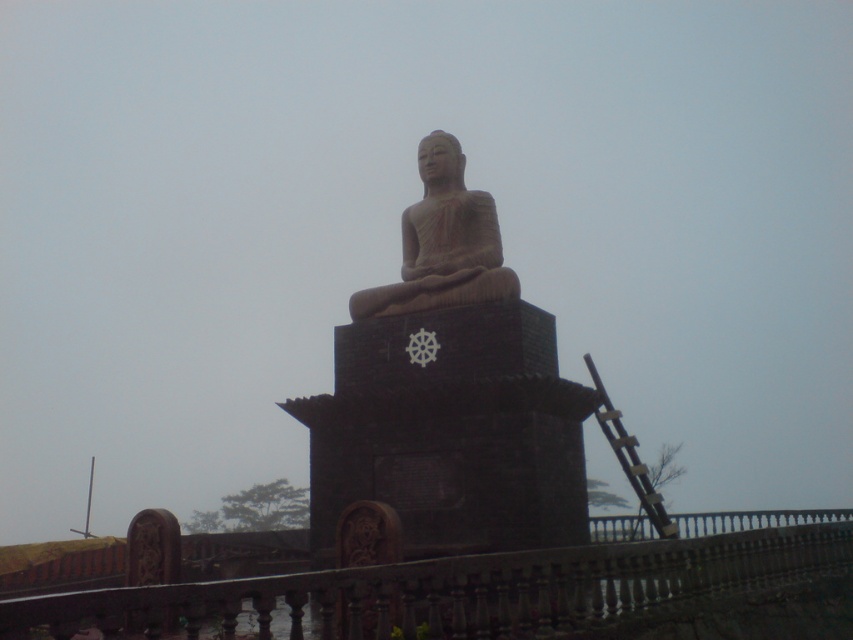
Question: Among these objects, which one is farthest from the camera?

Choices:
 (A) brown wooden railing at lower center
 (B) brown stone statue at center

Answer: (B)

Question: Which point appears closest to the camera in this image?

Choices:
 (A) (439, 259)
 (B) (419, 618)

Answer: (B)

Question: In this image, where is brown wooden railing at lower center located relative to brown stone statue at center?

Choices:
 (A) right
 (B) left

Answer: (B)

Question: Is brown wooden railing at lower center wider than brown stone statue at center?

Choices:
 (A) no
 (B) yes

Answer: (B)

Question: Which object appears closest to the camera in this image?

Choices:
 (A) brown wooden railing at lower center
 (B) brown stone statue at center

Answer: (A)

Question: Is brown wooden railing at lower center bigger than brown stone statue at center?

Choices:
 (A) no
 (B) yes

Answer: (B)